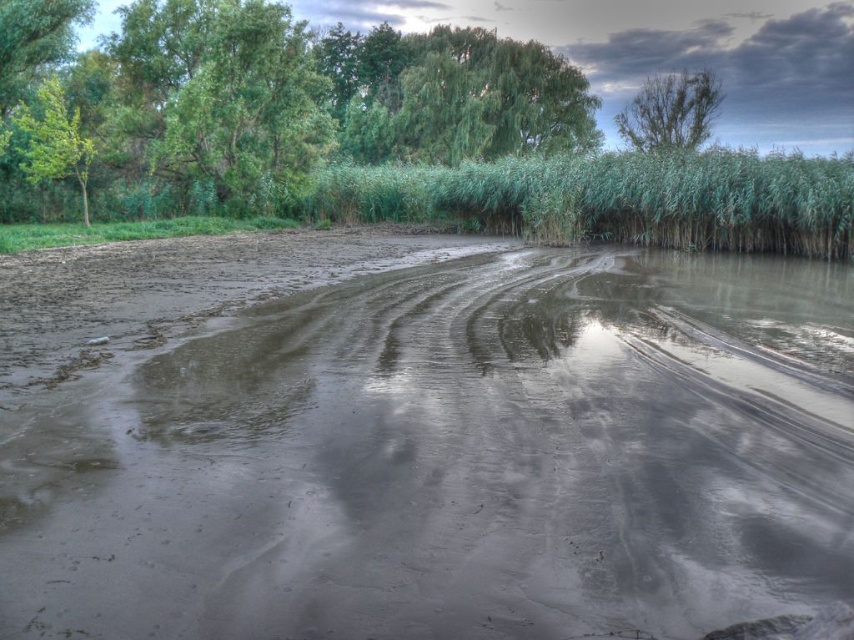
You are standing at the edge of the muddy wetland at center and want to reach the green leafy tree at upper left. Based on the scene description, which direction should you head towards to get closer to the tree?

You should head towards the upper left direction to reach the green leafy tree at upper left, as it is located in that direction relative to the muddy wetland at center.

You are an observer standing at the muddy bank in the foreground of the image. You see two green leafy trees in the upper part of the scene. Which tree, the green leafy tree at upper right or the green leafy tree at upper left, appears bigger?

The green leafy tree at upper right is larger in size than the green leafy tree at upper left.

Looking at the scene, where is the muddy wetland at center in relation to the green grassy reed at upper center?

The muddy wetland at center is located to the left of the green grassy reed at upper center.